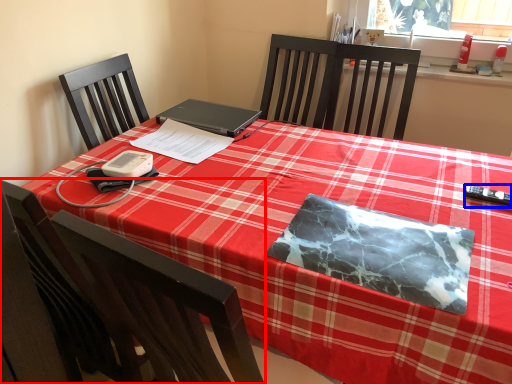
Question: Which of the following is the farthest to the observer, chair (highlighted by a red box) or remote control (highlighted by a blue box)?

Choices:
 (A) chair
 (B) remote control

Answer: (B)